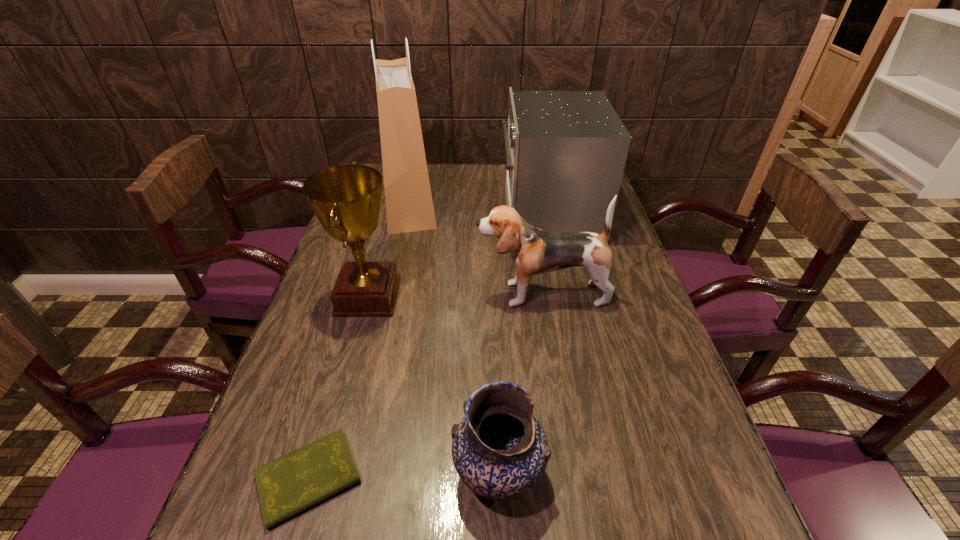
Locate an element on the screen. This screenshot has height=540, width=960. vacant point located on the plaque of the award is located at coordinates (492, 296).

The image size is (960, 540). Find the location of `vacant space located at the face of the puppy`. vacant space located at the face of the puppy is located at coordinates (419, 294).

At what (x,y) coordinates should I click in order to perform the action: click on vacant area located at the face of the puppy. Please return your answer as a coordinate pair (x, y). Looking at the image, I should click on (422, 294).

Identify the location of vacant space located 0.110m at the face of the puppy. The width and height of the screenshot is (960, 540). (434, 294).

I want to click on vacant area situated 0.220m on the left of the second shortest object, so click(x=331, y=474).

You are a GUI agent. You are given a task and a screenshot of the screen. Output one action in this format:
    pyautogui.click(x=<x>, y=<y>)
    Task: Click on the vacant space located 0.060m on the back of the diary
    Image resolution: width=960 pixels, height=540 pixels.
    Given the screenshot: What is the action you would take?
    pyautogui.click(x=330, y=407)

The image size is (960, 540). I want to click on shopping bag located at the far edge, so click(x=409, y=207).

Locate an element on the screen. toaster oven present at the far edge is located at coordinates (565, 151).

Locate an element on the screen. This screenshot has height=540, width=960. shopping bag located in the left edge section of the desktop is located at coordinates (409, 207).

At what (x,y) coordinates should I click in order to perform the action: click on award that is at the left edge. Please return your answer as a coordinate pair (x, y). The height and width of the screenshot is (540, 960). Looking at the image, I should click on (346, 199).